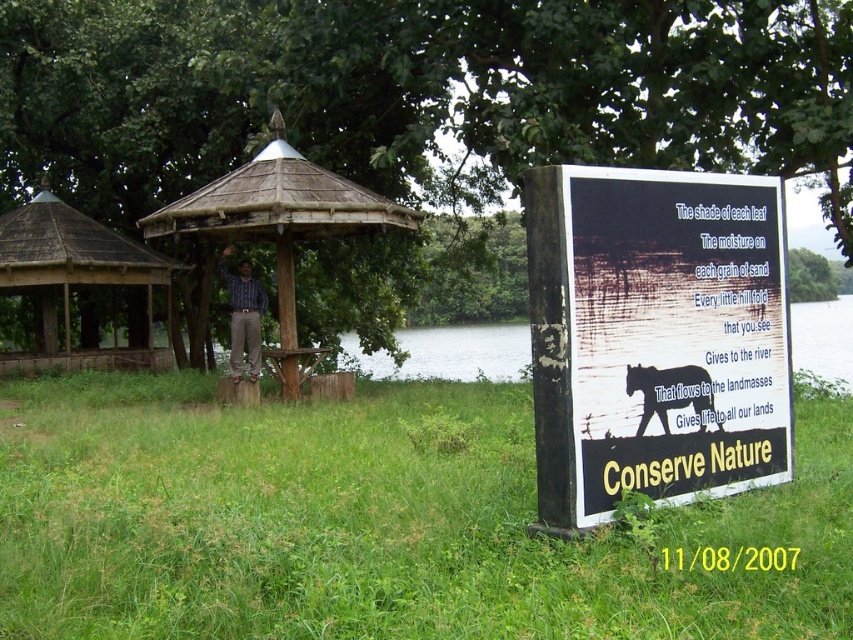
You are a hiker who wants to take a photo of the wooden gazebo at center and the green leafy tree at upper center. Which object should you focus on first to ensure both are in the frame?

You should focus on the green leafy tree at upper center first because it is closer to you than the wooden gazebo at center, so adjusting the camera to include it will also capture the gazebo in the background.

You are a hiker who wants to take a photo of the silhouette glossy black bear at right and the green leafy tree at upper center. From your current position, which object should you focus on first to ensure both are in the frame?

The green leafy tree at upper center is to the left of the silhouette glossy black bear at right, so you should focus on the silhouette glossy black bear at right first to ensure both are in the frame.

You are a hiker trying to take a photo of the wooden gazebo at center from the green leafy tree at upper center. Can you see the gazebo clearly through the tree?

The green leafy tree at upper center is larger than the wooden gazebo at center, so the gazebo might be partially obscured by the tree leaves, making it hard to see clearly.